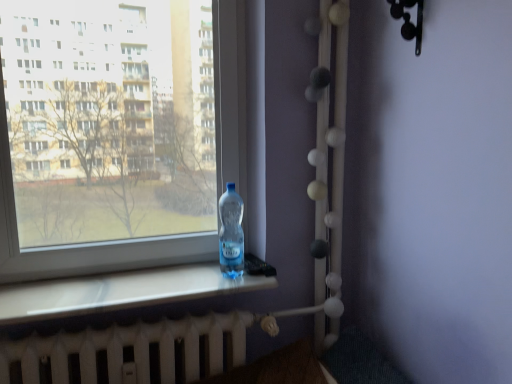
This screenshot has width=512, height=384. What do you see at coordinates (231, 233) in the screenshot?
I see `transparent plastic bottle at window` at bounding box center [231, 233].

Find the location of `transparent plastic bottle at left`. transparent plastic bottle at left is located at coordinates (83, 244).

The height and width of the screenshot is (384, 512). Find the location of `transparent plastic bottle at window`. transparent plastic bottle at window is located at coordinates (231, 233).

How much distance is there between white matte radiator at bottom and transparent plastic bottle at left?

The distance of white matte radiator at bottom from transparent plastic bottle at left is 13.38 inches.

Considering the points (218, 314) and (3, 124), which point is in front, point (218, 314) or point (3, 124)?

The point (3, 124) is closer to the camera.

From a real-world perspective, is white matte radiator at bottom positioned over transparent plastic bottle at left based on gravity?

Actually, white matte radiator at bottom is physically below transparent plastic bottle at left in the real world.

Does white matte radiator at bottom turn towards transparent plastic bottle at left?

No, white matte radiator at bottom is not turned towards transparent plastic bottle at left.

Considering the relative positions of transparent plastic bottle at left and white matte radiator at bottom in the image provided, is transparent plastic bottle at left to the left of white matte radiator at bottom from the viewer's perspective?

Correct, you'll find transparent plastic bottle at left to the left of white matte radiator at bottom.

How many degrees apart are the facing directions of transparent plastic bottle at left and white matte radiator at bottom?

0.109 degrees.

From a real-world perspective, is transparent plastic bottle at left physically above white matte radiator at bottom?

Yes.

Does point (108, 258) come behind point (166, 373)?

Yes, point (108, 258) is farther from viewer.

From a real-world perspective, does transparent plastic bottle at window stand above transparent plastic bottle at left?

No, from a real-world perspective, transparent plastic bottle at window is not above transparent plastic bottle at left.

Which of these two, transparent plastic bottle at window or transparent plastic bottle at left, is wider?

Wider between the two is transparent plastic bottle at window.

Which is in front, transparent plastic bottle at window or transparent plastic bottle at left?

transparent plastic bottle at left is in front.

Is transparent plastic bottle at window at the left side of transparent plastic bottle at left?

Incorrect, transparent plastic bottle at window is not on the left side of transparent plastic bottle at left.

From the image's perspective, does transparent plastic bottle at window appear lower than white matte radiator at bottom?

No, from the image's perspective, transparent plastic bottle at window is not below white matte radiator at bottom.

Would you say transparent plastic bottle at window is outside white matte radiator at bottom?

Yes, transparent plastic bottle at window is outside of white matte radiator at bottom.

Is the depth of transparent plastic bottle at window less than that of white matte radiator at bottom?

No, it is behind white matte radiator at bottom.

From the image's perspective, which is below, white matte radiator at bottom or transparent plastic bottle at window?

white matte radiator at bottom is shown below in the image.

In terms of width, does white matte radiator at bottom look wider or thinner when compared to transparent plastic bottle at window?

Considering their sizes, white matte radiator at bottom looks broader than transparent plastic bottle at window.

What's the angular difference between white matte radiator at bottom and transparent plastic bottle at window's facing directions?

2.87 degrees separate the facing orientations of white matte radiator at bottom and transparent plastic bottle at window.

From their relative heights in the image, would you say white matte radiator at bottom is taller or shorter than transparent plastic bottle at window?

In the image, white matte radiator at bottom appears to be taller than transparent plastic bottle at window.

Can you confirm if transparent plastic bottle at left is shorter than transparent plastic bottle at window?

No.

From the image's perspective, is transparent plastic bottle at left on transparent plastic bottle at window?

Correct, transparent plastic bottle at left appears higher than transparent plastic bottle at window in the image.

Considering the positions of points (74, 248) and (231, 236), is point (74, 248) closer to camera compared to point (231, 236)?

That is True.

At what (x,y) coordinates should I click in order to perform the action: click on window on the left of white matte radiator at bottom. Please return your answer as a coordinate pair (x, y). The width and height of the screenshot is (512, 384). Looking at the image, I should click on (83, 244).

The image size is (512, 384). Find the location of `window lying above the white matte radiator at bottom (from the image's perspective)`. window lying above the white matte radiator at bottom (from the image's perspective) is located at coordinates (83, 244).

Estimate the real-world distances between objects in this image. Which object is further from transparent plastic bottle at window, transparent plastic bottle at left or white matte radiator at bottom?

Among the two, white matte radiator at bottom is located further to transparent plastic bottle at window.

When comparing their distances from white matte radiator at bottom, does transparent plastic bottle at left or transparent plastic bottle at window seem further?

transparent plastic bottle at window lies further to white matte radiator at bottom than the other object.

Based on their spatial positions, is transparent plastic bottle at window or white matte radiator at bottom further from transparent plastic bottle at left?

Based on the image, white matte radiator at bottom appears to be further to transparent plastic bottle at left.

Estimate the real-world distances between objects in this image. Which object is further from transparent plastic bottle at left, white matte radiator at bottom or transparent plastic bottle at window?

white matte radiator at bottom.

Looking at the image, which one is located closer to white matte radiator at bottom, transparent plastic bottle at window or transparent plastic bottle at left?

transparent plastic bottle at left is closer to white matte radiator at bottom.

From the image, which object appears to be nearer to transparent plastic bottle at window, white matte radiator at bottom or transparent plastic bottle at left?

Based on the image, transparent plastic bottle at left appears to be nearer to transparent plastic bottle at window.

Identify the location of bottle that lies between transparent plastic bottle at left and white matte radiator at bottom from top to bottom. (231, 233).